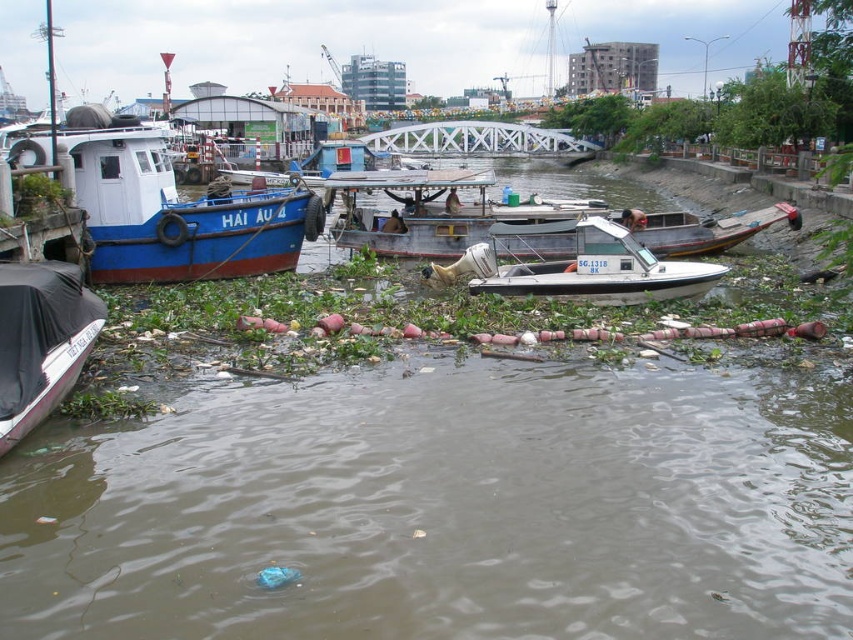
What do you see at coordinates (165, 205) in the screenshot? I see `blue matte boat at left` at bounding box center [165, 205].

Is blue matte boat at left further to the viewer compared to white matte boat at center?

No, blue matte boat at left is in front of white matte boat at center.

Consider the image. Measure the distance between blue matte boat at left and camera.

blue matte boat at left and camera are 69.97 feet apart from each other.

Where is `blue matte boat at left`? blue matte boat at left is located at coordinates (165, 205).

Is blue matte boat at left taller than white plastic boat at center?

Yes.

Is point (292, 256) closer to viewer compared to point (730, 236)?

Yes.

This screenshot has width=853, height=640. Identify the location of blue matte boat at left. (x=165, y=205).

Identify the location of blue matte boat at left. [165, 205].

Between blue matte boat at left and black tarpaulin boat at lower left, which one has more height?

blue matte boat at left is taller.

Does blue matte boat at left appear on the right side of black tarpaulin boat at lower left?

No, blue matte boat at left is not to the right of black tarpaulin boat at lower left.

Which is behind, point (120, 144) or point (12, 364)?

The point (120, 144) is more distant.

Where is `blue matte boat at left`? The image size is (853, 640). blue matte boat at left is located at coordinates (165, 205).